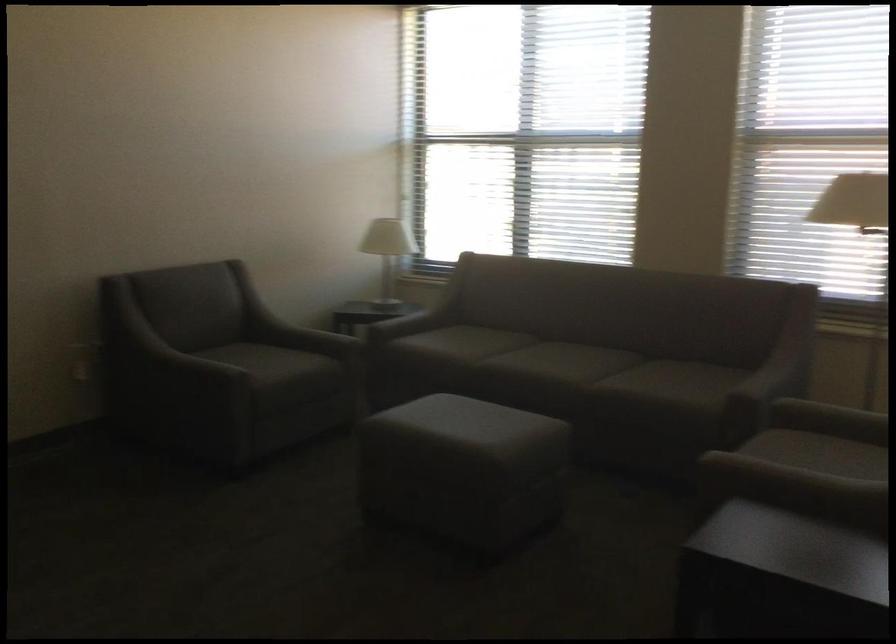
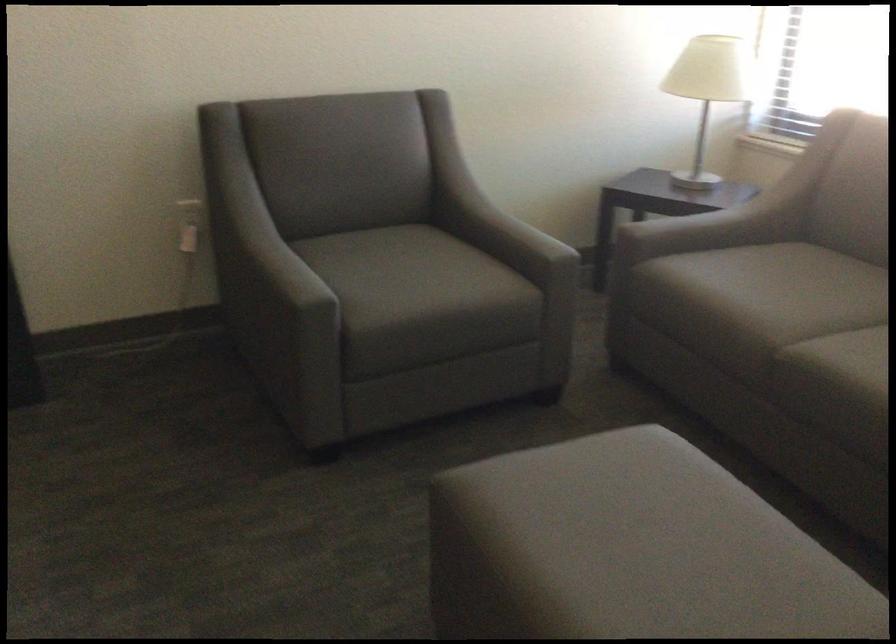
Where in the second image is the point corresponding to (74,359) from the first image?

(188, 225)